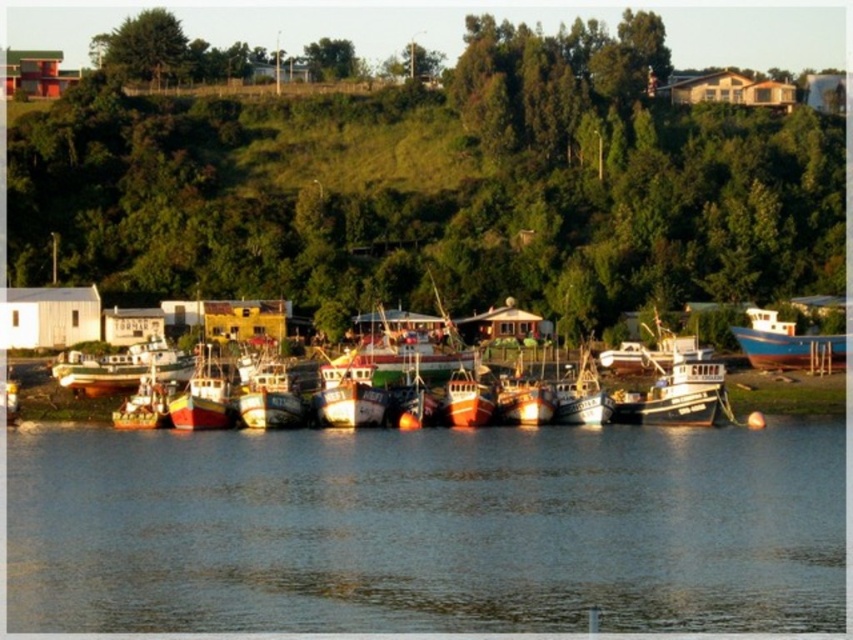
You are a photographer planning to capture a sunset shot from the waterfront. You want to ensure the green grassy hillside at upper center and the blue matte boat at right are both visible in your frame. Based on their positions, which object will appear higher in the photo?

Result: The green grassy hillside at upper center will appear higher in the photo because it is positioned over the blue matte boat at right.

You are standing on the wooden fishing boat at center and want to climb up to the green grassy hillside at upper center. Is the hillside above or below your current position?

The green grassy hillside at upper center is positioned over the wooden fishing boat at center, so it is above your current position.